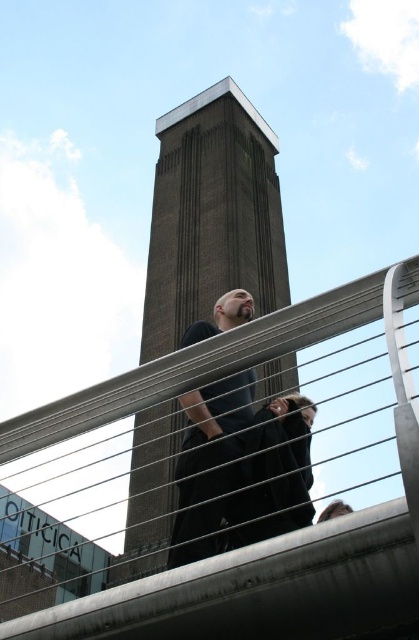
Question: Which object is the farthest from the metallic gray pedestrian bridge at center?

Choices:
 (A) brown brick tower at center
 (B) dark blue shirt at center

Answer: (A)

Question: Which object appears closest to the camera in this image?

Choices:
 (A) brown brick tower at center
 (B) dark blue shirt at center

Answer: (B)

Question: Does metallic gray pedestrian bridge at center have a larger size compared to brown brick tower at center?

Choices:
 (A) yes
 (B) no

Answer: (A)

Question: Is brown brick tower at center bigger than dark blue shirt at center?

Choices:
 (A) yes
 (B) no

Answer: (A)

Question: Is brown brick tower at center below dark blue shirt at center?

Choices:
 (A) no
 (B) yes

Answer: (A)

Question: Estimate the real-world distances between objects in this image. Which object is farther from the brown brick tower at center?

Choices:
 (A) metallic gray pedestrian bridge at center
 (B) dark blue shirt at center

Answer: (A)